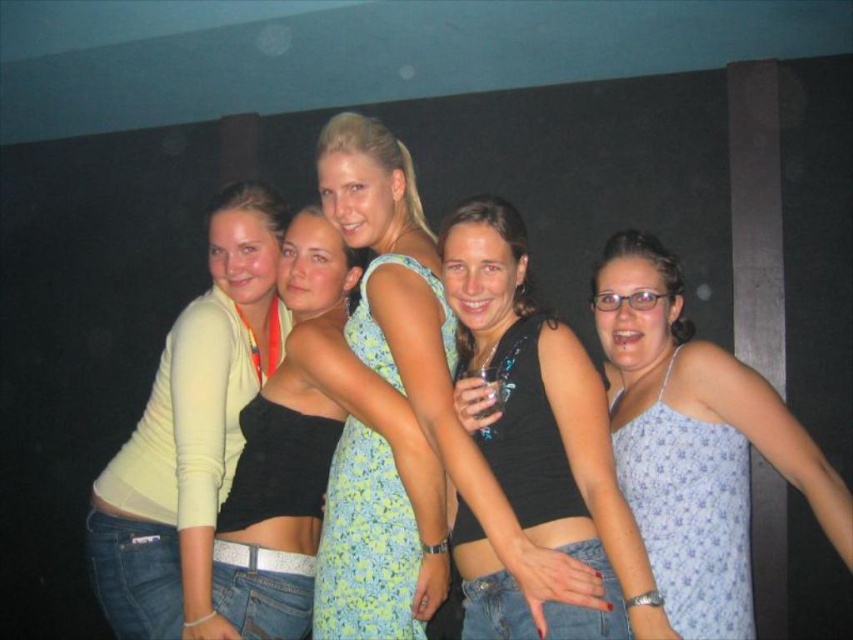
You are standing in the room and want to move closer to both the point at coordinates (358, 476) and the point at (215, 352). Which point will you reach first if you move directly towards them?

You will reach point (358, 476) first because it is closer to you than point (215, 352).

You are at a party and notice two outfits at the center of the group. The floral dress at center and the light blue printed tank top at center. Which one is positioned higher?

The floral dress at center is located above the light blue printed tank top at center, so the floral dress at center is positioned higher.